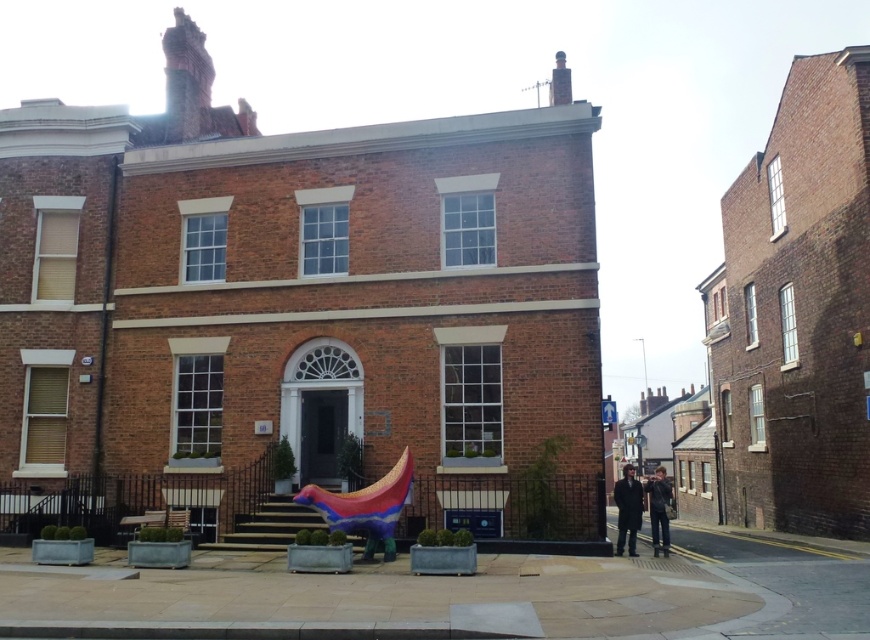
Question: Is dark brown leather coat at lower right to the right of dark blue jeans at lower right from the viewer's perspective?

Choices:
 (A) yes
 (B) no

Answer: (B)

Question: Among these points, which one is farthest from the camera?

Choices:
 (A) (659, 476)
 (B) (632, 476)

Answer: (A)

Question: Is dark brown leather coat at lower right thinner than dark blue jeans at lower right?

Choices:
 (A) no
 (B) yes

Answer: (A)

Question: Which point is farther from the camera taking this photo?

Choices:
 (A) (628, 484)
 (B) (661, 467)

Answer: (B)

Question: Does dark brown leather coat at lower right have a smaller size compared to dark blue jeans at lower right?

Choices:
 (A) no
 (B) yes

Answer: (A)